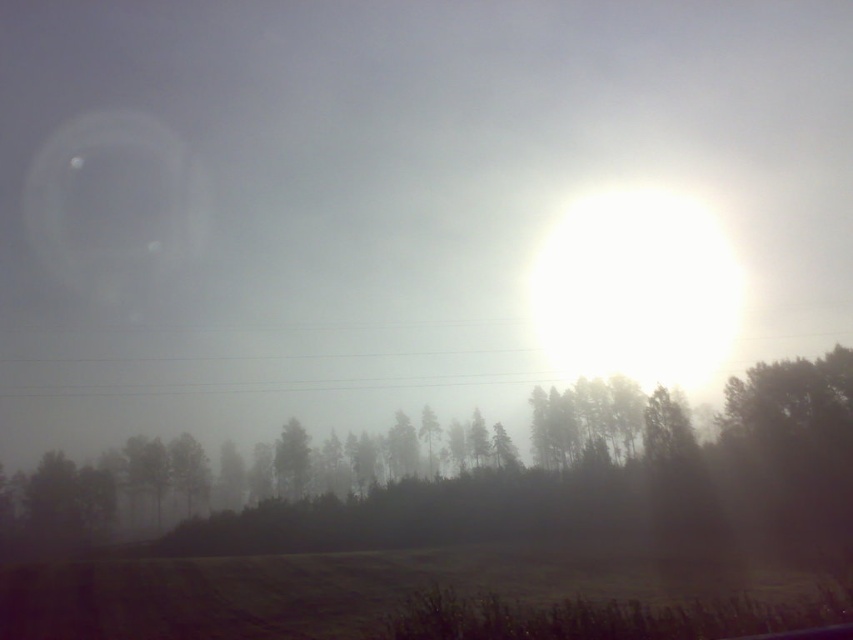
You are standing in the field and see two points in the scene. The first point is at coordinates point (688, 483) and the second is at point (289, 490). Which point is closer to you?

Point (688, 483) is in front of point (289, 490), so the first point is closer to you.